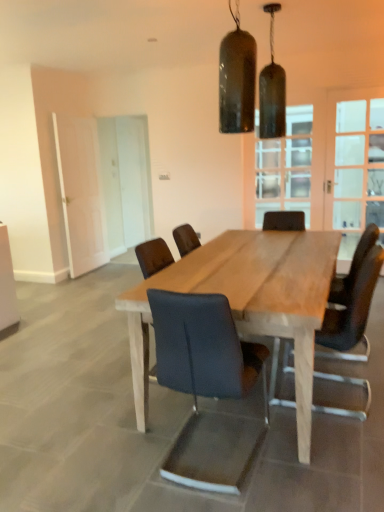
Question: From a real-world perspective, is white glass screen door at left, marked as the 1th screen door in a right-to-left arrangement, beneath natural wood table at center?

Choices:
 (A) no
 (B) yes

Answer: (A)

Question: Considering the relative sizes of white glass screen door at left, marked as the 1th screen door in a right-to-left arrangement, and natural wood table at center in the image provided, is white glass screen door at left, marked as the 1th screen door in a right-to-left arrangement, bigger than natural wood table at center?

Choices:
 (A) yes
 (B) no

Answer: (B)

Question: Considering the relative positions of white glass screen door at left, marked as the 2th screen door in a left-to-right arrangement, and natural wood table at center in the image provided, is white glass screen door at left, marked as the 2th screen door in a left-to-right arrangement, to the right of natural wood table at center from the viewer's perspective?

Choices:
 (A) yes
 (B) no

Answer: (B)

Question: From the image's perspective, is white glass screen door at left, marked as the 1th screen door in a right-to-left arrangement, on top of natural wood table at center?

Choices:
 (A) yes
 (B) no

Answer: (A)

Question: Does white glass screen door at left, marked as the 2th screen door in a left-to-right arrangement, lie behind natural wood table at center?

Choices:
 (A) yes
 (B) no

Answer: (A)

Question: From a real-world perspective, is matte black chair at center, placed as the 2th chair when sorted from left to right, positioned above or below matte glass pendant lights at upper center, acting as the 1th lamp starting from the front?

Choices:
 (A) above
 (B) below

Answer: (B)

Question: From the image's perspective, is matte black chair at center, placed as the 2th chair when sorted from left to right, located above or below matte glass pendant lights at upper center, acting as the 1th lamp starting from the front?

Choices:
 (A) above
 (B) below

Answer: (B)

Question: Considering the positions of matte black chair at center, the second chair viewed from the right, and matte glass pendant lights at upper center, the 2th lamp in the back-to-front sequence, in the image, is matte black chair at center, the second chair viewed from the right, wider or thinner than matte glass pendant lights at upper center, the 2th lamp in the back-to-front sequence,?

Choices:
 (A) wide
 (B) thin

Answer: (A)

Question: Does point (193, 297) appear closer or farther from the camera than point (223, 91)?

Choices:
 (A) farther
 (B) closer

Answer: (B)

Question: Visually, is matte black pendant light at upper center, which is the second lamp in front-to-back order, positioned to the left or to the right of leather-like black chair at center, which is counted as the 3th chair, starting from the left?

Choices:
 (A) left
 (B) right

Answer: (A)

Question: Is matte black pendant light at upper center, the second lamp viewed from the left, taller or shorter than leather-like black chair at center, which is counted as the 3th chair, starting from the left?

Choices:
 (A) short
 (B) tall

Answer: (A)

Question: From a real-world perspective, is matte black pendant light at upper center, which is the second lamp in front-to-back order, physically located above or below leather-like black chair at center, which is counted as the 3th chair, starting from the left?

Choices:
 (A) above
 (B) below

Answer: (A)

Question: Is matte black pendant light at upper center, which ranks as the first lamp in back-to-front order, in front of or behind leather-like black chair at center, which is counted as the 3th chair, starting from the left, in the image?

Choices:
 (A) front
 (B) behind

Answer: (B)

Question: Is point (69, 247) positioned closer to the camera than point (145, 264)?

Choices:
 (A) farther
 (B) closer

Answer: (A)

Question: In terms of width, does white matte door at left, the 2th screen door from the right, look wider or thinner when compared to dark blue fabric chair at center, which appears as the 1th chair when viewed from the left?

Choices:
 (A) wide
 (B) thin

Answer: (B)